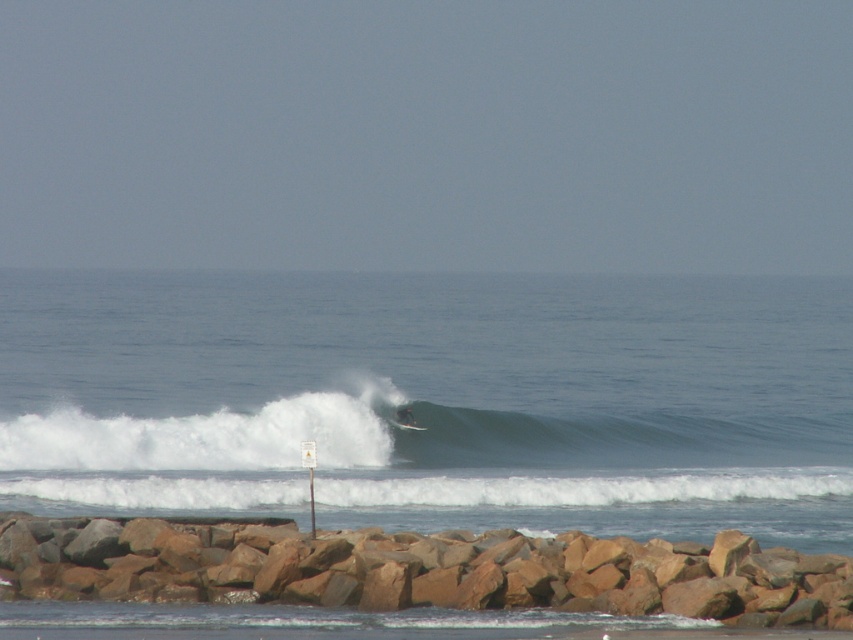
Based on the scene description, what does the point at coordinates (x=434, y=401) represent?

The point at coordinates (x=434, y=401) corresponds to white frothy water at center.

You are standing at the edge of the rocky jetty and want to place a small buoy exactly at the point marked by point [418,570]. Which direction should you walk from the jetty to reach the brown rock at lower center?

The point [418,570] marks the location of the brown rock at lower center, so you should walk towards the lower center direction from the jetty to reach it.

You are standing on the beach and see the brown rock at lower center and the white foam surfboard at center. Which object is positioned to the right side of the other?

The brown rock at lower center is to the right of the white foam surfboard at center.